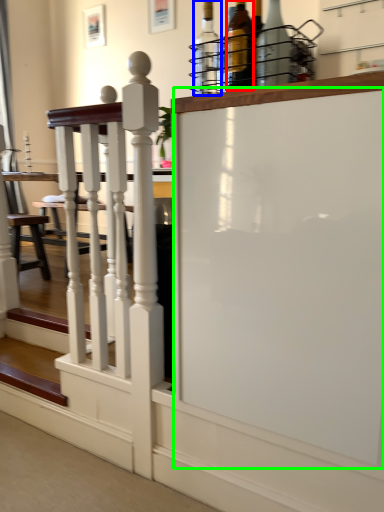
Question: Considering the real-world distances, which object is farthest from bottle (highlighted by a red box)? bottle (highlighted by a blue box) or screen door (highlighted by a green box)?

Choices:
 (A) bottle
 (B) screen door

Answer: (B)